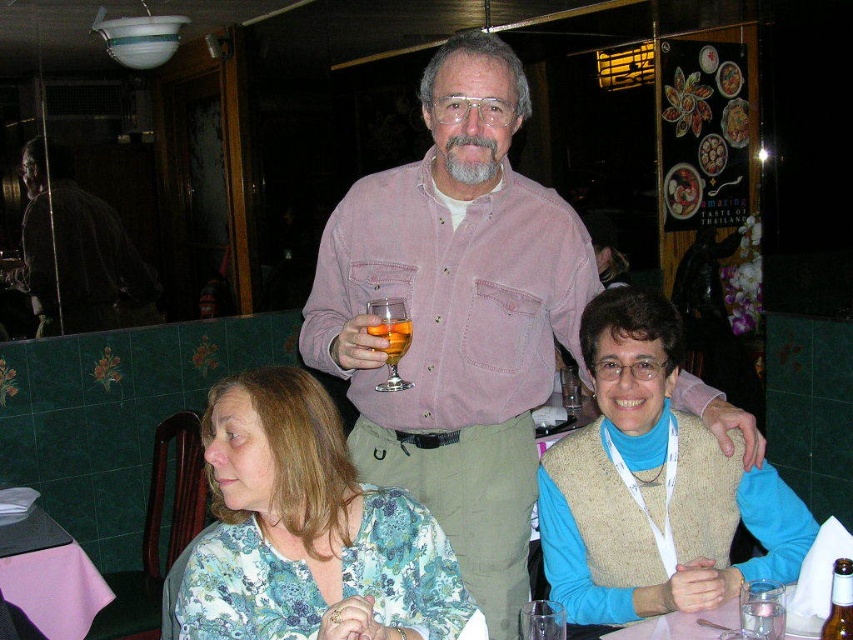
In the scene described, where is the knitted beige vest at center located in terms of coordinates?

The knitted beige vest at center is located at coordinates point (x=653, y=486).

You are a waiter in a restaurant and you see the clear glass water at lower center and the translucent glass wine glass at center. Which one is more to the right?

The clear glass water at lower center is more to the right.

In the scene shown: You are a photographer trying to capture a clear shot of the pink cotton shirt at center and the transparent glass at lower center. Which object is closer to the camera?

The pink cotton shirt at center is closer to the camera than the transparent glass at lower center because it is further to the viewer.